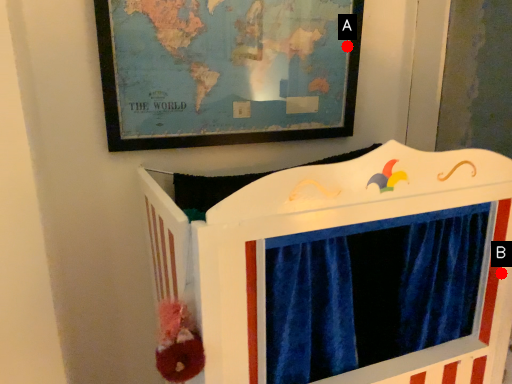
Question: Two points are circled on the image, labeled by A and B beside each circle. Which point appears closest to the camera in this image?

Choices:
 (A) A is closer
 (B) B is closer

Answer: (B)